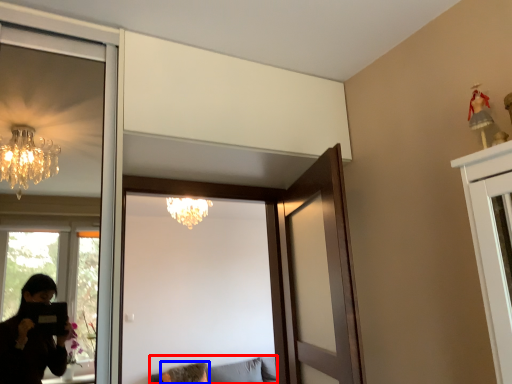
Question: Among these objects, which one is nearest to the camera, furniture (highlighted by a red box) or woman (highlighted by a blue box)?

Choices:
 (A) furniture
 (B) woman

Answer: (A)